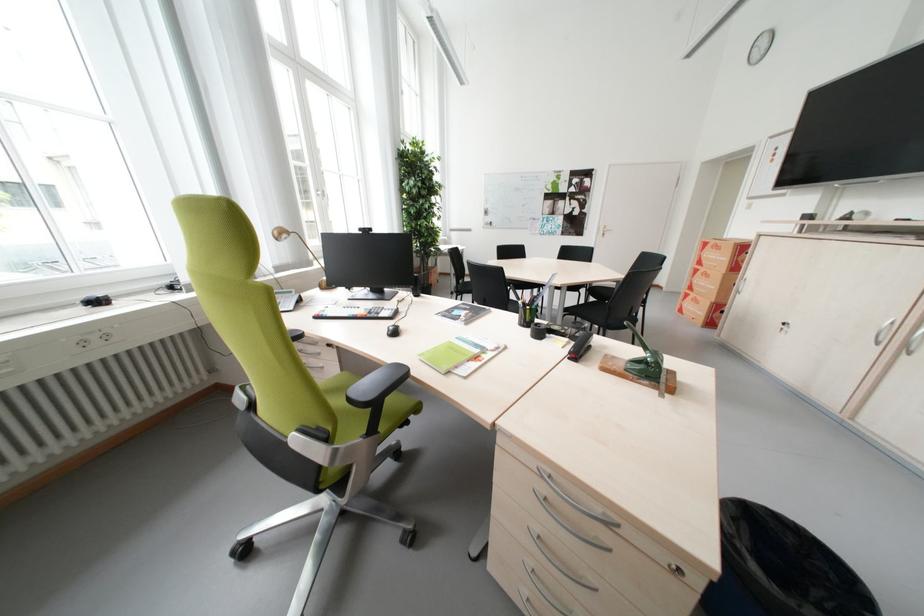
Find the location of a particular element. green hole punch is located at coordinates (643, 360).